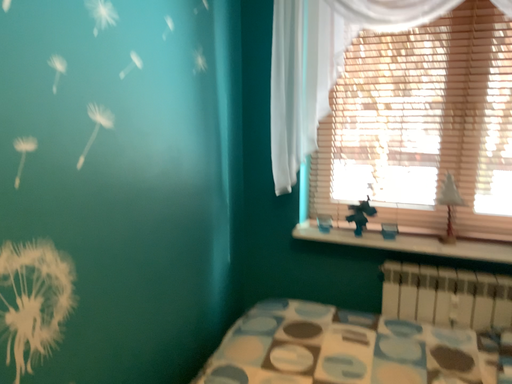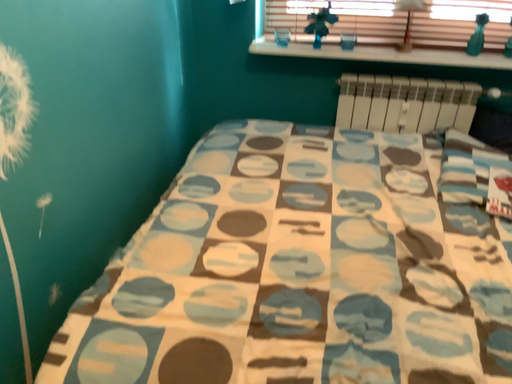
Question: How did the camera likely rotate when shooting the video?

Choices:
 (A) rotated left
 (B) rotated right

Answer: (B)